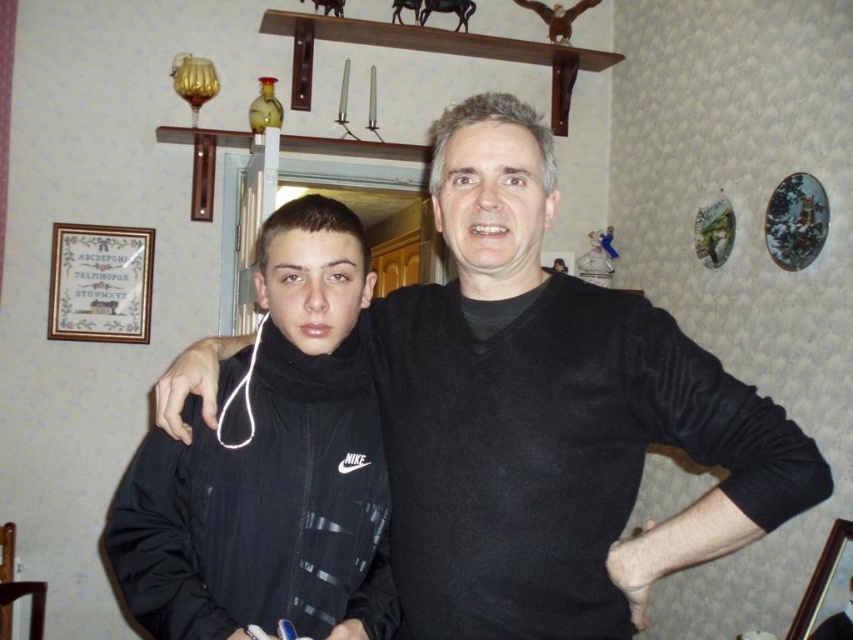
You are a photographer adjusting the lighting in the scene. You need to ensure that both the black matte sweater at center and the black matte jacket at center are fully visible. Since they are very similar in color, what should you be cautious about when positioning the light source?

You should be cautious about the angle of the light source because the black matte sweater at center is in front of the black matte jacket at center. If the light is positioned in a way that casts a shadow of the sweater onto the jacket, it might obscure the jacket from view, making both items appear as a single dark mass.

You are standing in the room and see two points marked in the image. The first point is at coordinate point(x=589, y=301) and the second is at point(x=344, y=212). Which point is closer to you?

→ Point(x=589, y=301) is in front of point(x=344, y=212), so it is closer to you.

Looking at this image, you are standing in the room and want to place a small gift box at the exact center of the room. The black matte sweater at center is located at point coordinates of (550,417). Is this point suitable for placing the gift box?

Yes, the point at coordinates (550,417) is suitable for placing the gift box since it is exactly where the black matte sweater at center is located, which is at the center of the room.